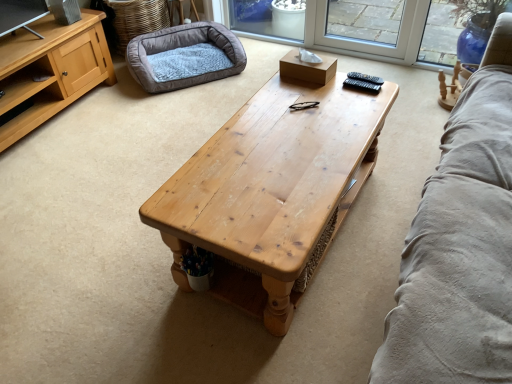
Describe the element at coordinates (184, 56) in the screenshot. The image size is (512, 384). I see `soft gray plush dog bed at upper left` at that location.

Locate an element on the screen. soft gray plush dog bed at upper left is located at coordinates (184, 56).

Image resolution: width=512 pixels, height=384 pixels. Describe the element at coordinates (271, 191) in the screenshot. I see `wooden coffee table at center` at that location.

What is the approximate width of wooden coffee table at center?

wooden coffee table at center is 59.47 centimeters in width.

This screenshot has width=512, height=384. Find the location of `wooden coffee table at center`. wooden coffee table at center is located at coordinates (271, 191).

Image resolution: width=512 pixels, height=384 pixels. I want to click on soft gray plush dog bed at upper left, so click(184, 56).

Is wooden coffee table at center at the left side of soft gray plush dog bed at upper left?

Incorrect, wooden coffee table at center is not on the left side of soft gray plush dog bed at upper left.

Relative to soft gray plush dog bed at upper left, is wooden coffee table at center in front or behind?

wooden coffee table at center is in front of soft gray plush dog bed at upper left.

Considering the positions of point (239, 292) and point (205, 42), is point (239, 292) closer or farther from the camera than point (205, 42)?

Point (239, 292) is positioned closer to the camera compared to point (205, 42).

From the image's perspective, is wooden coffee table at center on top of soft gray plush dog bed at upper left?

No.

From a real-world perspective, between wooden coffee table at center and soft gray plush dog bed at upper left, who is vertically lower?

soft gray plush dog bed at upper left, from a real-world perspective.

Does wooden coffee table at center have a greater width compared to soft gray plush dog bed at upper left?

Indeed, wooden coffee table at center has a greater width compared to soft gray plush dog bed at upper left.

Can you confirm if wooden coffee table at center is shorter than soft gray plush dog bed at upper left?

In fact, wooden coffee table at center may be taller than soft gray plush dog bed at upper left.

Considering the relative sizes of wooden coffee table at center and soft gray plush dog bed at upper left in the image provided, is wooden coffee table at center bigger than soft gray plush dog bed at upper left?

Indeed, wooden coffee table at center has a larger size compared to soft gray plush dog bed at upper left.

Does wooden coffee table at center contain soft gray plush dog bed at upper left?

That's incorrect, soft gray plush dog bed at upper left is not inside wooden coffee table at center.

Is wooden coffee table at center not near soft gray plush dog bed at upper left?

Absolutely, wooden coffee table at center is distant from soft gray plush dog bed at upper left.

Is wooden coffee table at center facing away from soft gray plush dog bed at upper left?

wooden coffee table at center is not turned away from soft gray plush dog bed at upper left.

You are a GUI agent. You are given a task and a screenshot of the screen. Output one action in this format:
    pyautogui.click(x=<x>, y=<y>)
    Task: Click on the dog bed on the left of the wooden coffee table at center
    
    Given the screenshot: What is the action you would take?
    pyautogui.click(x=184, y=56)

Which is more to the left, soft gray plush dog bed at upper left or wooden coffee table at center?

From the viewer's perspective, soft gray plush dog bed at upper left appears more on the left side.

Does soft gray plush dog bed at upper left come in front of wooden coffee table at center?

No, it is not.

Which is behind, point (223, 48) or point (255, 142)?

Point (223, 48)

From the image's perspective, would you say soft gray plush dog bed at upper left is positioned over wooden coffee table at center?

Yes.

From a real-world perspective, which is physically above, soft gray plush dog bed at upper left or wooden coffee table at center?

In real-world perspective, wooden coffee table at center is above.

In the scene shown: Considering the relative sizes of soft gray plush dog bed at upper left and wooden coffee table at center in the image provided, is soft gray plush dog bed at upper left wider than wooden coffee table at center?

No.

Can you confirm if soft gray plush dog bed at upper left is taller than wooden coffee table at center?

In fact, soft gray plush dog bed at upper left may be shorter than wooden coffee table at center.

Considering the sizes of soft gray plush dog bed at upper left and wooden coffee table at center in the image, is soft gray plush dog bed at upper left bigger or smaller than wooden coffee table at center?

Clearly, soft gray plush dog bed at upper left is smaller in size than wooden coffee table at center.

Would you say soft gray plush dog bed at upper left is inside or outside wooden coffee table at center?

soft gray plush dog bed at upper left lies outside wooden coffee table at center.

Is there a large distance between soft gray plush dog bed at upper left and wooden coffee table at center?

Yes.

Could you tell me if soft gray plush dog bed at upper left is turned towards wooden coffee table at center?

Yes, soft gray plush dog bed at upper left faces towards wooden coffee table at center.

Where is `dog bed on the left of wooden coffee table at center`? The image size is (512, 384). dog bed on the left of wooden coffee table at center is located at coordinates (184, 56).

This screenshot has width=512, height=384. Find the location of `coffee table that appears on the right of soft gray plush dog bed at upper left`. coffee table that appears on the right of soft gray plush dog bed at upper left is located at coordinates (271, 191).

Where is `coffee table in front of the soft gray plush dog bed at upper left`? The height and width of the screenshot is (384, 512). coffee table in front of the soft gray plush dog bed at upper left is located at coordinates (271, 191).